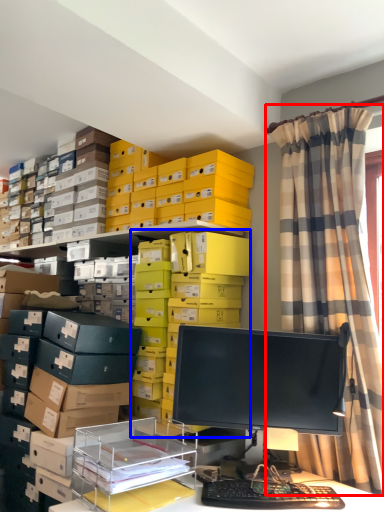
Question: Which object appears farthest to the camera in this image, curtain (highlighted by a red box) or shelf (highlighted by a blue box)?

Choices:
 (A) curtain
 (B) shelf

Answer: (B)